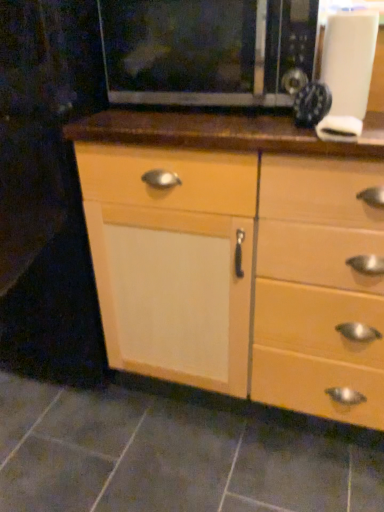
Question: Is white matte knob at upper right wider or thinner than black matte microwave at upper center?

Choices:
 (A) wide
 (B) thin

Answer: (B)

Question: Looking at the image, does white matte knob at upper right seem bigger or smaller compared to black matte microwave at upper center?

Choices:
 (A) small
 (B) big

Answer: (A)

Question: Which object is the closest to the wooden cabinet at center?

Choices:
 (A) white matte knob at upper right
 (B) gray tile at lower center
 (C) black matte microwave at upper center
 (D) metallic black clock at upper right

Answer: (C)

Question: Considering the real-world distances, which object is farthest from the black matte microwave at upper center?

Choices:
 (A) gray tile at lower center
 (B) wooden cabinet at center
 (C) metallic black clock at upper right
 (D) white matte knob at upper right

Answer: (A)